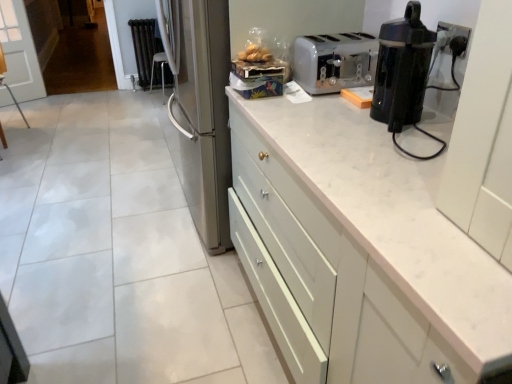
Question: From a real-world perspective, is translucent plastic bag of bread at upper center below black metallic radiator at upper left?

Choices:
 (A) no
 (B) yes

Answer: (A)

Question: From a real-world perspective, is translucent plastic bag of bread at upper center physically above black metallic radiator at upper left?

Choices:
 (A) no
 (B) yes

Answer: (B)

Question: Is translucent plastic bag of bread at upper center thinner than black metallic radiator at upper left?

Choices:
 (A) no
 (B) yes

Answer: (A)

Question: Can you confirm if translucent plastic bag of bread at upper center is smaller than black metallic radiator at upper left?

Choices:
 (A) yes
 (B) no

Answer: (A)

Question: Can you confirm if translucent plastic bag of bread at upper center is bigger than black metallic radiator at upper left?

Choices:
 (A) yes
 (B) no

Answer: (B)

Question: Does translucent plastic bag of bread at upper center contain black metallic radiator at upper left?

Choices:
 (A) no
 (B) yes

Answer: (A)

Question: Is black metallic radiator at upper left aimed at black plastic electric outlet at upper right?

Choices:
 (A) yes
 (B) no

Answer: (A)

Question: From a real-world perspective, is black metallic radiator at upper left located beneath black plastic electric outlet at upper right?

Choices:
 (A) yes
 (B) no

Answer: (A)

Question: From a real-world perspective, is black metallic radiator at upper left over black plastic electric outlet at upper right?

Choices:
 (A) yes
 (B) no

Answer: (B)

Question: Does black metallic radiator at upper left have a larger size compared to black plastic electric outlet at upper right?

Choices:
 (A) yes
 (B) no

Answer: (A)

Question: Does black metallic radiator at upper left have a greater width compared to black plastic electric outlet at upper right?

Choices:
 (A) yes
 (B) no

Answer: (A)

Question: Can you confirm if black metallic radiator at upper left is smaller than black plastic electric outlet at upper right?

Choices:
 (A) yes
 (B) no

Answer: (B)

Question: Is black metallic radiator at upper left positioned with its back to translucent plastic bag of bread at upper center?

Choices:
 (A) no
 (B) yes

Answer: (A)